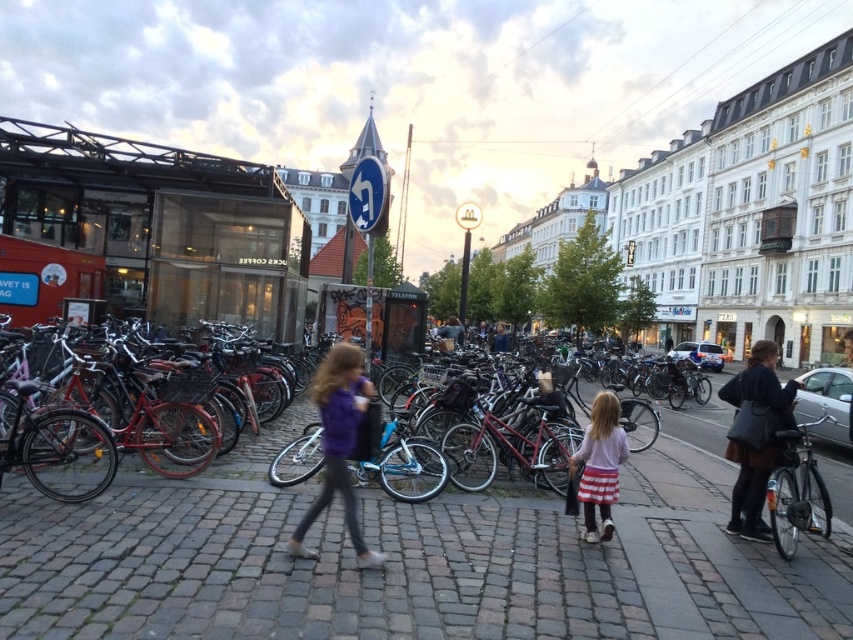
You are a delivery person who needs to quickly pass through the area between the purple fabric jacket at center and the shiny silver bicycle at right. Based on the scene description, can your 0.5 meter wide delivery cart fit through the space?

The purple fabric jacket at center is thinner than the shiny silver bicycle at right. Since the cart is 0.5 meters wide, and the space between them is wider than the jacket, it should fit.

You are a delivery person who needs to quickly access your backpack. You are standing between the dark brown leather jacket at right and the shiny silver bicycle at right. Which object is taller and closer to you?

The dark brown leather jacket at right is taller than the shiny silver bicycle at right, so it is closer to you.

You are a delivery person trying to place a small package on the ground in the scene. The package is the size of the pink fabric skirt at center. Can you place it on the cobblestone pavement at center without it being entirely covered?

The cobblestone pavement at center is bigger than the pink fabric skirt at center, so yes, the package can be placed there without being entirely covered since the pavement has enough space.